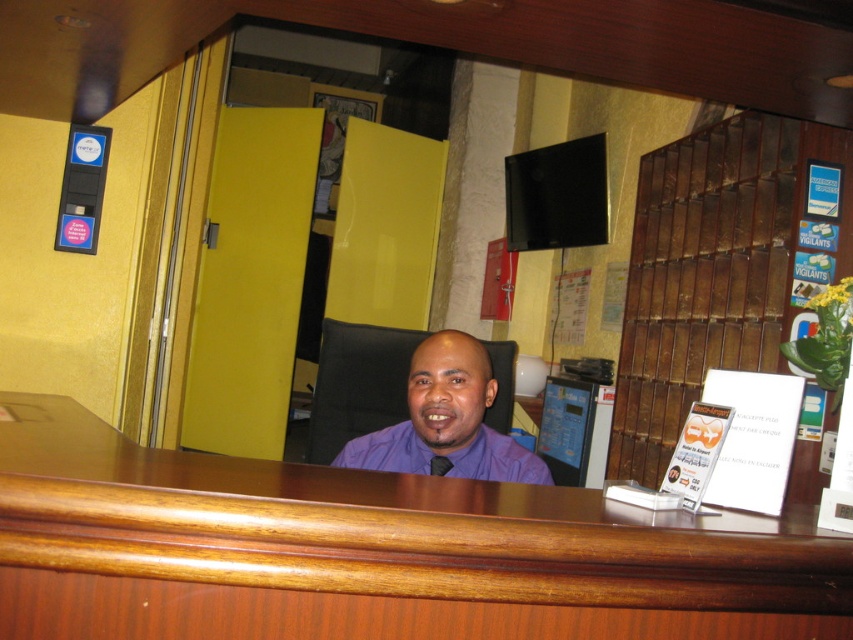
Question: Which point is farther from the camera taking this photo?

Choices:
 (A) (631, 520)
 (B) (421, 365)
 (C) (480, 456)
 (D) (447, 465)

Answer: (C)

Question: Observing the image, what is the correct spatial positioning of purple shirt at center in reference to purple matte dress shirt at center?

Choices:
 (A) right
 (B) left

Answer: (A)

Question: Can you confirm if purple shirt at center is thinner than purple matte dress shirt at center?

Choices:
 (A) yes
 (B) no

Answer: (B)

Question: Among these points, which one is nearest to the camera?

Choices:
 (A) (328, 529)
 (B) (374, 435)
 (C) (428, 474)

Answer: (A)

Question: Can you confirm if purple shirt at center is bigger than purple matte dress shirt at center?

Choices:
 (A) no
 (B) yes

Answer: (B)

Question: Among these objects, which one is farthest from the camera?

Choices:
 (A) purple satin tie at center
 (B) purple shirt at center
 (C) brown wood table at center
 (D) purple matte dress shirt at center

Answer: (A)